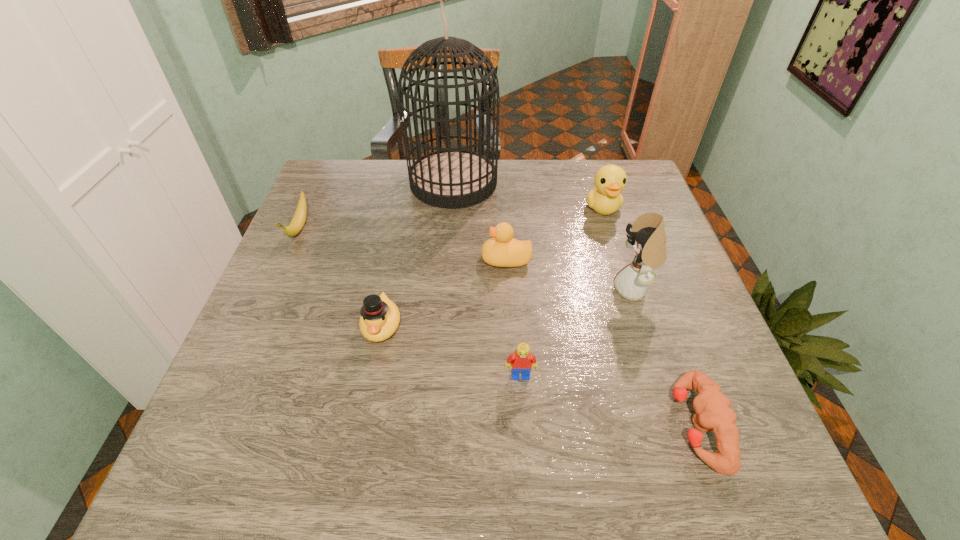
Locate an element on the screen. The image size is (960, 540). birdcage is located at coordinates (451, 178).

Locate an element on the screen. The width and height of the screenshot is (960, 540). the seventh shortest object is located at coordinates (648, 238).

Locate an element on the screen. the rightmost duck is located at coordinates (605, 198).

I want to click on the tallest duck, so click(x=605, y=198).

Where is `the second duck from right to left`? The width and height of the screenshot is (960, 540). the second duck from right to left is located at coordinates (502, 250).

Identify the location of the nearest duck. (380, 317).

The width and height of the screenshot is (960, 540). Find the location of `Lego`. Lego is located at coordinates (522, 361).

I want to click on the leftmost object, so click(x=299, y=218).

Find the location of a particular element. The image size is (960, 540). puncher is located at coordinates (713, 413).

Identify the location of vacant point located on the right of the tallest object. (604, 183).